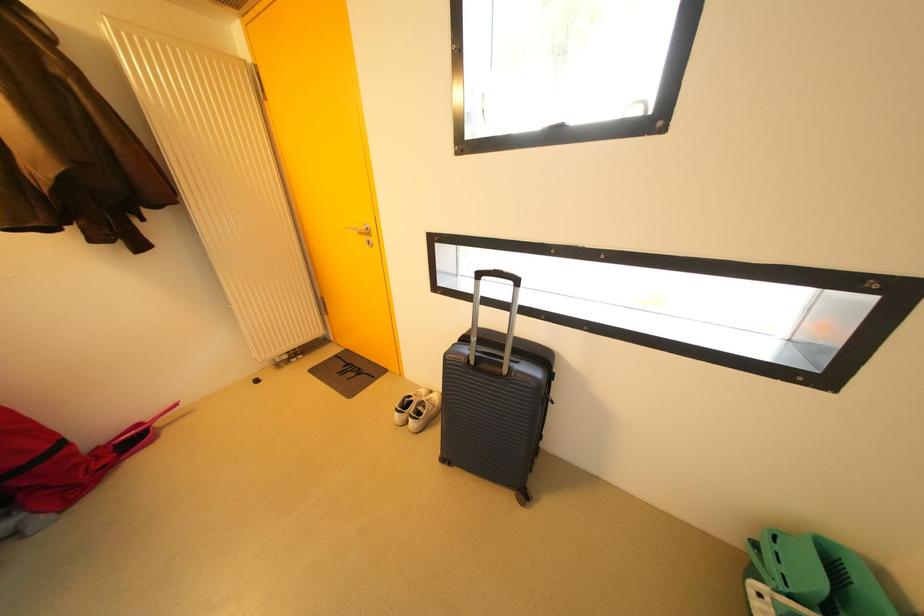
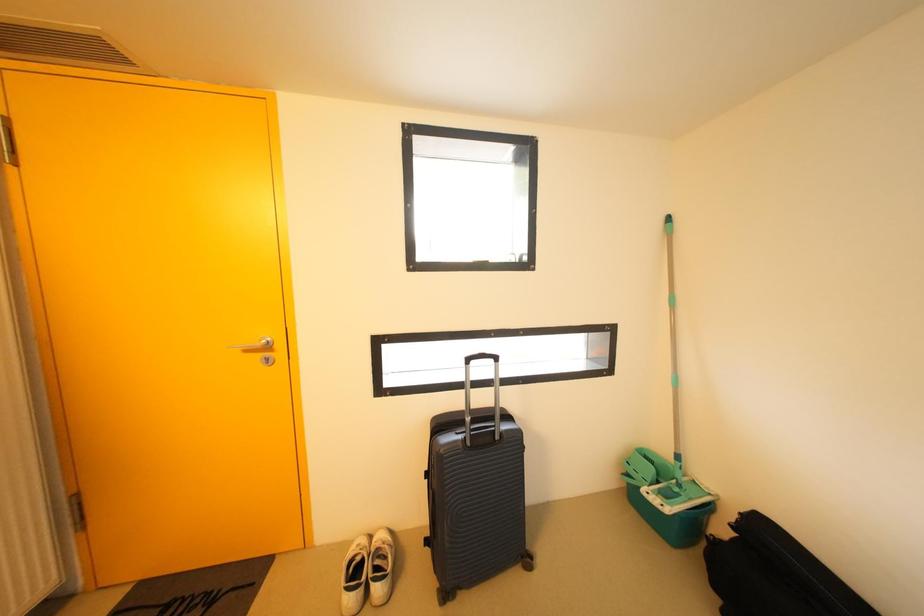
Question: How did the camera likely rotate?

Choices:
 (A) Left
 (B) Right
 (C) Up
 (D) Down

Answer: (B)